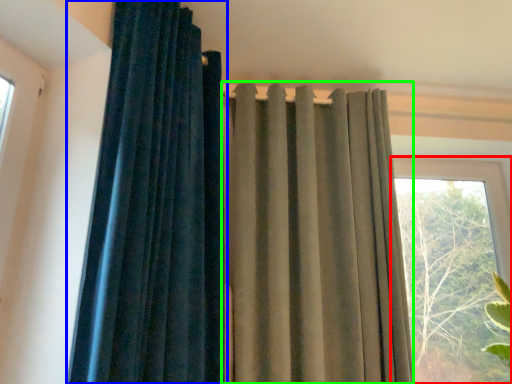
Question: Which object is positioned closest to window (highlighted by a red box)? Select from curtain (highlighted by a blue box) and curtain (highlighted by a green box).

Choices:
 (A) curtain
 (B) curtain

Answer: (B)